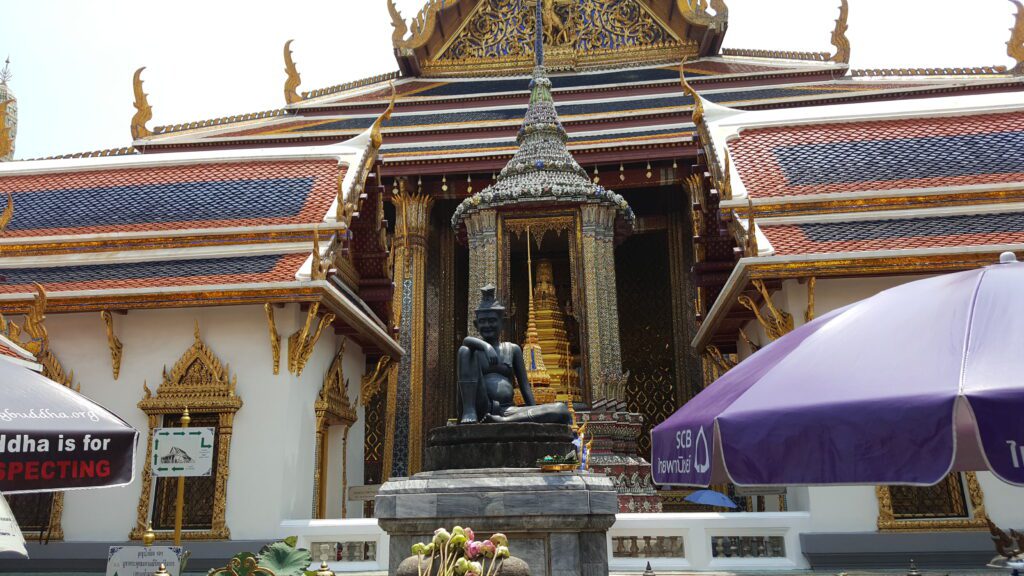
Where is `statue`? This screenshot has height=576, width=1024. statue is located at coordinates (487, 370).